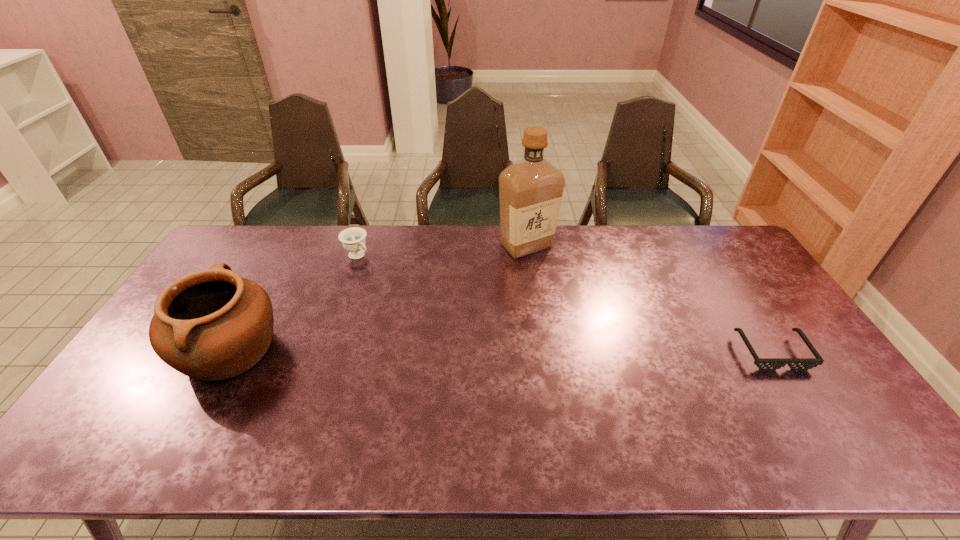
Image resolution: width=960 pixels, height=540 pixels. I want to click on free space on the desktop that is between the pottery and the rightmost object and is positioned on the front-facing side of the liquor, so click(524, 352).

The height and width of the screenshot is (540, 960). What are the coordinates of `vacant space on the desktop that is between the leftmost object and the shortest object and is positioned on the side of the second shortest object with the handle` in the screenshot? It's located at (473, 351).